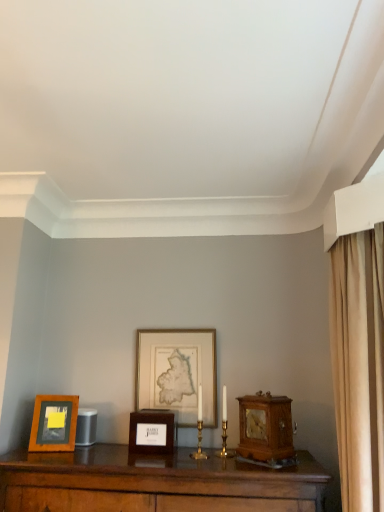
Question: Is gold-framed map at center, the third picture frame from the left, facing away from wooden picture frame at center, which is the second picture frame from left to right?

Choices:
 (A) no
 (B) yes

Answer: (A)

Question: Can you confirm if gold-framed map at center, the third picture frame from the left, is bigger than wooden picture frame at center, which is the second picture frame from left to right?

Choices:
 (A) yes
 (B) no

Answer: (A)

Question: Considering the relative sizes of gold-framed map at center, which is the first picture frame in right-to-left order, and wooden picture frame at center, which is the second picture frame from left to right, in the image provided, is gold-framed map at center, which is the first picture frame in right-to-left order, thinner than wooden picture frame at center, which is the second picture frame from left to right,?

Choices:
 (A) no
 (B) yes

Answer: (B)

Question: Is gold-framed map at center, the third picture frame from the left, taller than wooden picture frame at center, which is the 2th picture frame in right-to-left order?

Choices:
 (A) yes
 (B) no

Answer: (A)

Question: Is gold-framed map at center, the third picture frame from the left, positioned before wooden picture frame at center, which is the second picture frame from left to right?

Choices:
 (A) yes
 (B) no

Answer: (B)

Question: From the image's perspective, is wooden picture frame at left, which ranks as the first picture frame in left-to-right order, located above or below wooden picture frame at center, which is the 2th picture frame in right-to-left order?

Choices:
 (A) above
 (B) below

Answer: (A)

Question: Is wooden picture frame at left, the third picture frame in the right-to-left sequence, taller or shorter than wooden picture frame at center, which is the 2th picture frame in right-to-left order?

Choices:
 (A) short
 (B) tall

Answer: (B)

Question: From a real-world perspective, is wooden picture frame at left, which ranks as the first picture frame in left-to-right order, positioned above or below wooden picture frame at center, which is the 2th picture frame in right-to-left order?

Choices:
 (A) above
 (B) below

Answer: (A)

Question: Is wooden picture frame at left, which ranks as the first picture frame in left-to-right order, bigger or smaller than wooden picture frame at center, which is the 2th picture frame in right-to-left order?

Choices:
 (A) small
 (B) big

Answer: (A)

Question: From a real-world perspective, relative to gold-framed map at center, which is the first picture frame in right-to-left order, is wooden picture frame at left, the third picture frame in the right-to-left sequence, vertically above or below?

Choices:
 (A) below
 (B) above

Answer: (A)

Question: Looking at their shapes, would you say wooden picture frame at left, the third picture frame in the right-to-left sequence, is wider or thinner than gold-framed map at center, which is the first picture frame in right-to-left order?

Choices:
 (A) thin
 (B) wide

Answer: (B)

Question: In the image, is wooden picture frame at left, the third picture frame in the right-to-left sequence, on the left side or the right side of gold-framed map at center, the third picture frame from the left?

Choices:
 (A) left
 (B) right

Answer: (A)

Question: Is wooden picture frame at left, the third picture frame in the right-to-left sequence, in front of or behind gold-framed map at center, which is the first picture frame in right-to-left order, in the image?

Choices:
 (A) front
 (B) behind

Answer: (A)

Question: Looking at their shapes, would you say wooden picture frame at left, which ranks as the first picture frame in left-to-right order, is wider or thinner than wooden alarm clock at right?

Choices:
 (A) thin
 (B) wide

Answer: (A)

Question: In the image, is wooden picture frame at left, the third picture frame in the right-to-left sequence, on the left side or the right side of wooden alarm clock at right?

Choices:
 (A) right
 (B) left

Answer: (B)